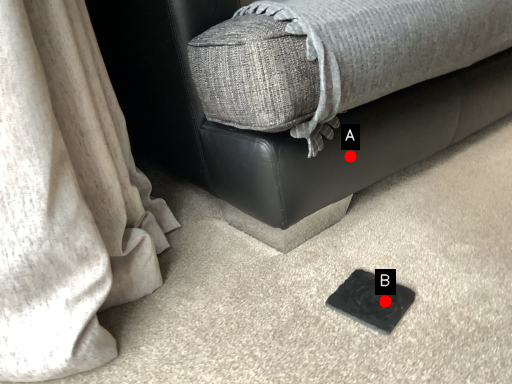
Question: Two points are circled on the image, labeled by A and B beside each circle. Which of the following is the farthest from the observer?

Choices:
 (A) A is further
 (B) B is further

Answer: (A)